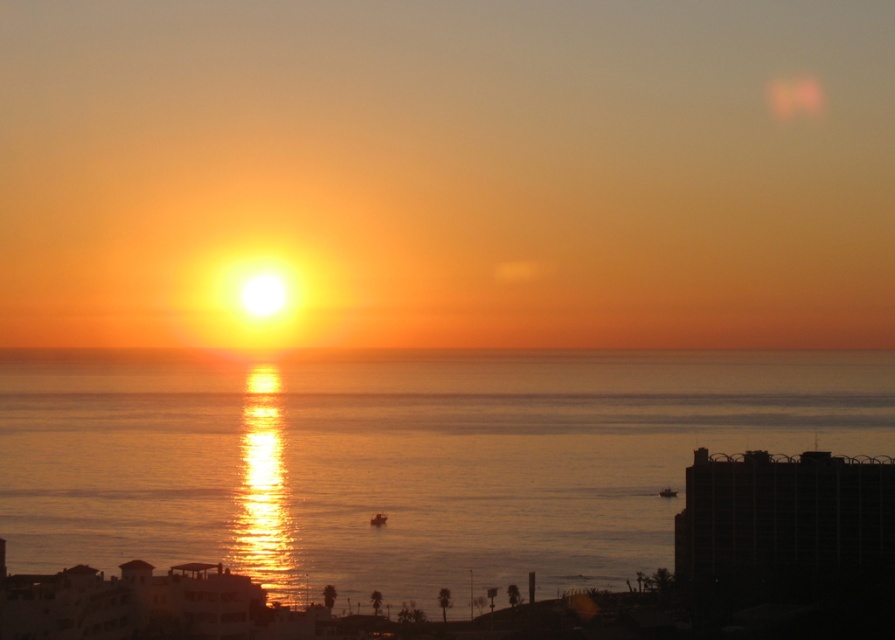
Question: Is the position of glistening water at center less distant than that of orange matte horizon at center?

Choices:
 (A) no
 (B) yes

Answer: (B)

Question: Does glistening water at center appear on the left side of orange matte horizon at center?

Choices:
 (A) yes
 (B) no

Answer: (A)

Question: Which point is farther to the camera?

Choices:
 (A) glistening water at center
 (B) orange matte horizon at center

Answer: (B)

Question: Which of the following is the farthest from the observer?

Choices:
 (A) click(x=71, y=356)
 (B) click(x=564, y=420)

Answer: (A)

Question: Is glistening water at center above orange matte horizon at center?

Choices:
 (A) yes
 (B) no

Answer: (B)